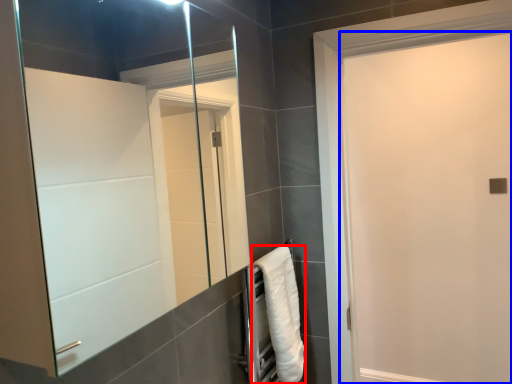
Question: Which of the following is the farthest to the observer, towel (highlighted by a red box) or screen door (highlighted by a blue box)?

Choices:
 (A) towel
 (B) screen door

Answer: (A)